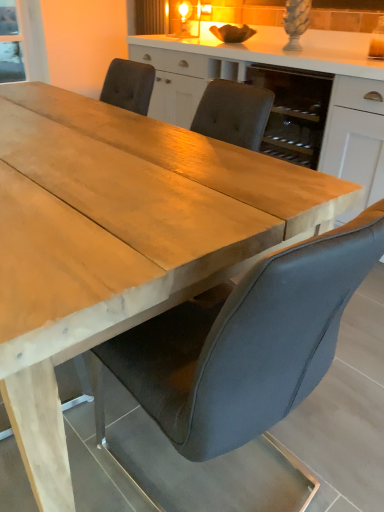
At what (x,y) coordinates should I click in order to perform the action: click on white matte cabinet at center. Please return your answer as a coordinate pair (x, y). This screenshot has width=384, height=512. Looking at the image, I should click on (355, 138).

What do you see at coordinates (355, 138) in the screenshot?
I see `white matte cabinet at center` at bounding box center [355, 138].

This screenshot has width=384, height=512. What do you see at coordinates (233, 377) in the screenshot?
I see `suede gray chair at center` at bounding box center [233, 377].

Where is `suede gray chair at center`? The image size is (384, 512). suede gray chair at center is located at coordinates (233, 377).

Locate an element on the screen. The image size is (384, 512). white matte cabinet at center is located at coordinates 355,138.

Visually, is suede gray chair at center positioned to the left or to the right of white matte cabinet at center?

suede gray chair at center is to the left of white matte cabinet at center.

Consider the image. Does suede gray chair at center lie in front of white matte cabinet at center?

Yes, suede gray chair at center is closer to the viewer.

Is point (347, 226) positioned before point (330, 103)?

Yes, it is in front of point (330, 103).

From the image's perspective, is suede gray chair at center beneath white matte cabinet at center?

Yes.

From a real-world perspective, which object rests below the other?

suede gray chair at center is physically lower.

Which object is thinner, suede gray chair at center or white matte cabinet at center?

With smaller width is suede gray chair at center.

Is suede gray chair at center taller than white matte cabinet at center?

No, suede gray chair at center is not taller than white matte cabinet at center.

Which of these two, suede gray chair at center or white matte cabinet at center, is bigger?

Bigger between the two is white matte cabinet at center.

Is white matte cabinet at center a part of suede gray chair at center?

No, white matte cabinet at center is located outside of suede gray chair at center.

Would you say suede gray chair at center is a long distance from white matte cabinet at center?

Absolutely, suede gray chair at center is distant from white matte cabinet at center.

Is white matte cabinet at center at the back of suede gray chair at center?

suede gray chair at center does not have its back to white matte cabinet at center.

This screenshot has width=384, height=512. I want to click on chair that is in front of the white matte cabinet at center, so click(233, 377).

Is white matte cabinet at center to the left of suede gray chair at center from the viewer's perspective?

Incorrect, white matte cabinet at center is not on the left side of suede gray chair at center.

Does white matte cabinet at center come in front of suede gray chair at center?

No, it is behind suede gray chair at center.

Considering the positions of points (367, 170) and (205, 350), is point (367, 170) farther from camera compared to point (205, 350)?

That is True.

From the image's perspective, is white matte cabinet at center on suede gray chair at center?

Yes, from the image's perspective, white matte cabinet at center is over suede gray chair at center.

From a real-world perspective, is white matte cabinet at center positioned under suede gray chair at center based on gravity?

No.

Considering the relative sizes of white matte cabinet at center and suede gray chair at center in the image provided, is white matte cabinet at center wider than suede gray chair at center?

Yes, white matte cabinet at center is wider than suede gray chair at center.

Considering the sizes of white matte cabinet at center and suede gray chair at center in the image, is white matte cabinet at center taller or shorter than suede gray chair at center?

In the image, white matte cabinet at center appears to be taller than suede gray chair at center.

Is white matte cabinet at center smaller than suede gray chair at center?

Actually, white matte cabinet at center might be larger than suede gray chair at center.

From the picture: Do you think white matte cabinet at center is within suede gray chair at center, or outside of it?

white matte cabinet at center is outside suede gray chair at center.

Is there a large distance between white matte cabinet at center and suede gray chair at center?

That's right, there is a large distance between white matte cabinet at center and suede gray chair at center.

Is white matte cabinet at center positioned with its back to suede gray chair at center?

No.

This screenshot has height=512, width=384. I want to click on cabinetry behind the suede gray chair at center, so click(355, 138).

In the image, there is a white matte cabinet at center. Where is `chair below it (from the image's perspective)`? chair below it (from the image's perspective) is located at coordinates (233, 377).

Find the location of a particular element. The width and height of the screenshot is (384, 512). cabinetry that appears above the suede gray chair at center (from the image's perspective) is located at coordinates click(x=355, y=138).